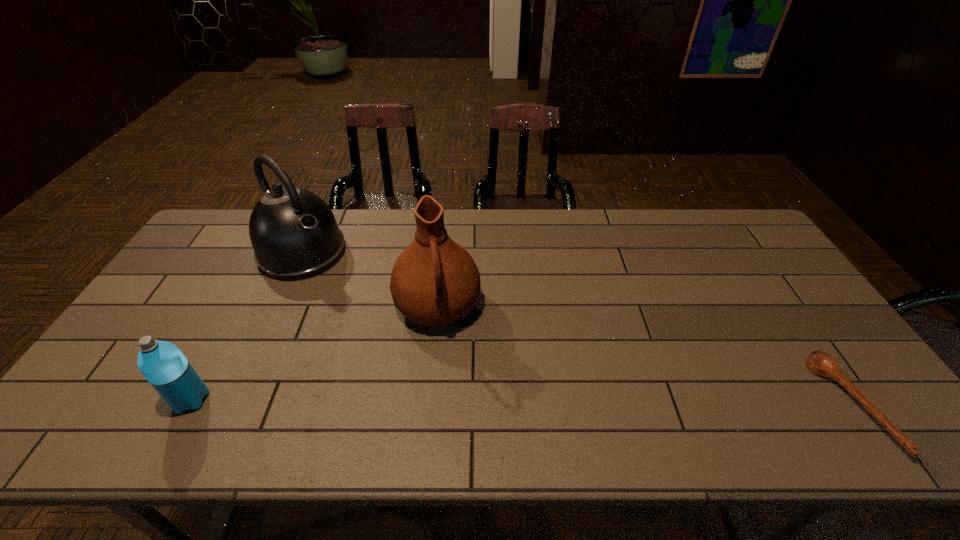
You are a GUI agent. You are given a task and a screenshot of the screen. Output one action in this format:
    pyautogui.click(x=<x>, y=<y>)
    Task: Click on the free space between the thermos bottle and the kettle
    
    Given the screenshot: What is the action you would take?
    pyautogui.click(x=247, y=327)

I want to click on empty location between the pitcher and the kettle, so click(x=370, y=280).

The width and height of the screenshot is (960, 540). What are the coordinates of `vacant area between the pitcher and the wooden spoon` in the screenshot? It's located at (643, 356).

You are a GUI agent. You are given a task and a screenshot of the screen. Output one action in this format:
    pyautogui.click(x=<x>, y=<y>)
    Task: Click on the second closest object relative to the rightmost object
    This screenshot has height=540, width=960.
    Given the screenshot: What is the action you would take?
    pyautogui.click(x=294, y=234)

Select which object appears as the third closest to the third tallest object. Please provide its 2D coordinates. Your answer should be formatted as a tuple, i.e. [(x, y)], where the tuple contains the x and y coordinates of a point satisfying the conditions above.

[(819, 363)]

The height and width of the screenshot is (540, 960). Identify the location of blank area in the image that satisfies the following two spatial constraints: 1. on the back side of the second shortest object; 2. on the right side of the third object from left to right. (242, 307).

The height and width of the screenshot is (540, 960). Find the location of `vacant space that satisfies the following two spatial constraints: 1. on the front side of the thermos bottle; 2. on the left side of the rightmost object`. vacant space that satisfies the following two spatial constraints: 1. on the front side of the thermos bottle; 2. on the left side of the rightmost object is located at coordinates (189, 404).